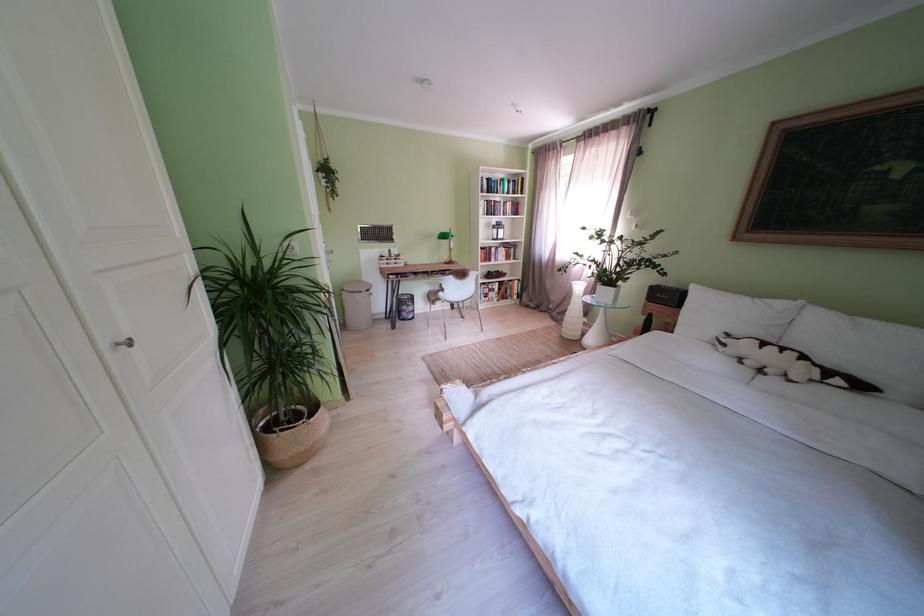
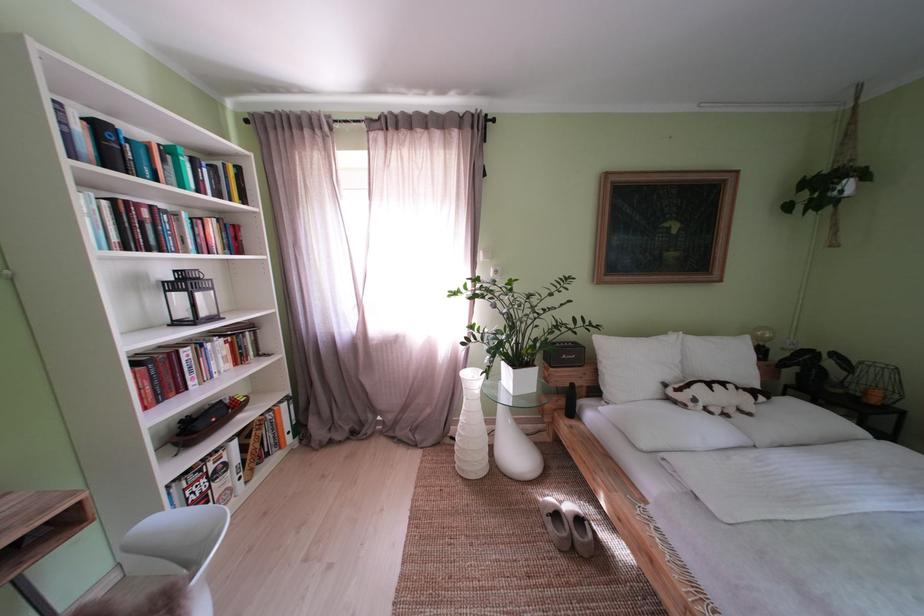
Where in the second image is the point corresponding to pixel 735 350 from the first image?

(706, 406)